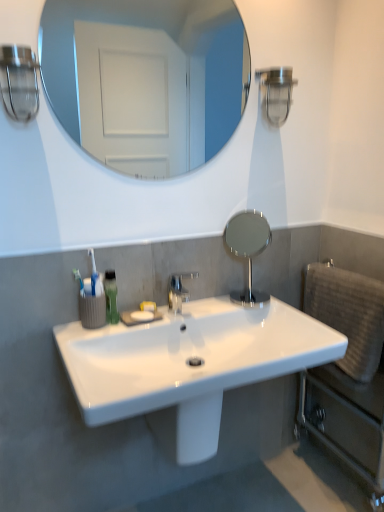
Question: Is point (183, 294) positioned closer to the camera than point (289, 350)?

Choices:
 (A) closer
 (B) farther

Answer: (B)

Question: Is polished chrome faucet at center wider or thinner than white glossy sink at center?

Choices:
 (A) thin
 (B) wide

Answer: (A)

Question: Which is nearer to the polished silver mirror at center, which is the 2th mirror from top to bottom?

Choices:
 (A) green matte mouthwash at lower left
 (B) polished chrome faucet at center
 (C) beige textured towel at right
 (D) clear glass mirror at upper center, the second mirror when ordered from right to left
 (E) clear glass light fixture at upper left

Answer: (B)

Question: Which of these objects is positioned farthest from the polished chrome faucet at center?

Choices:
 (A) beige textured towel at right
 (B) green matte mouthwash at lower left
 (C) clear glass light fixture at upper left
 (D) clear glass mirror at upper center, the 1th mirror positioned from the top
 (E) polished silver mirror at center, the 1th mirror from the bottom

Answer: (D)